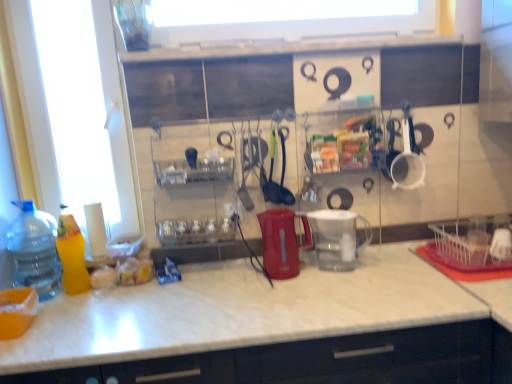
The width and height of the screenshot is (512, 384). Find the location of `vacant space situated on the left part of matte plastic kettle at center, which ranks as the 1th appliance in left-to-right order`. vacant space situated on the left part of matte plastic kettle at center, which ranks as the 1th appliance in left-to-right order is located at coordinates (244, 281).